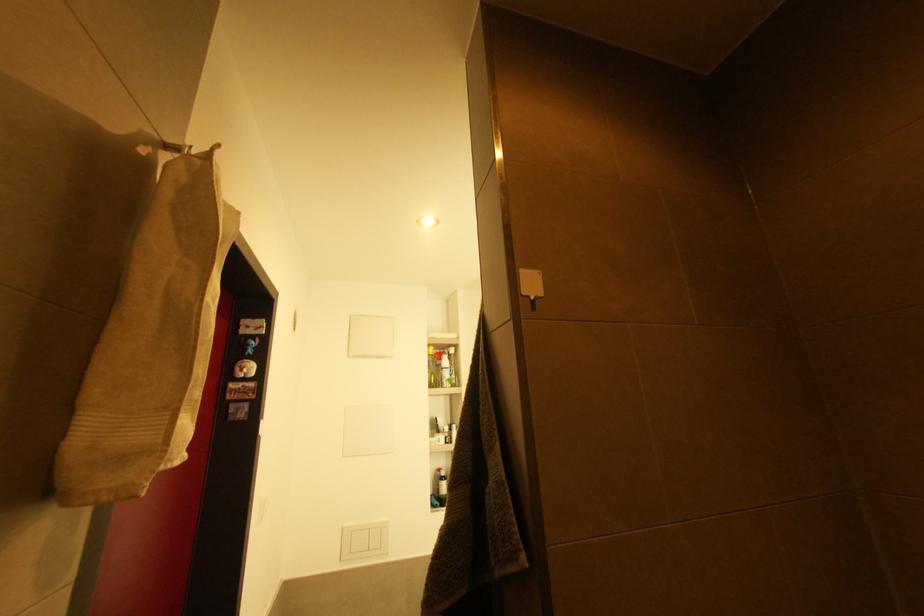
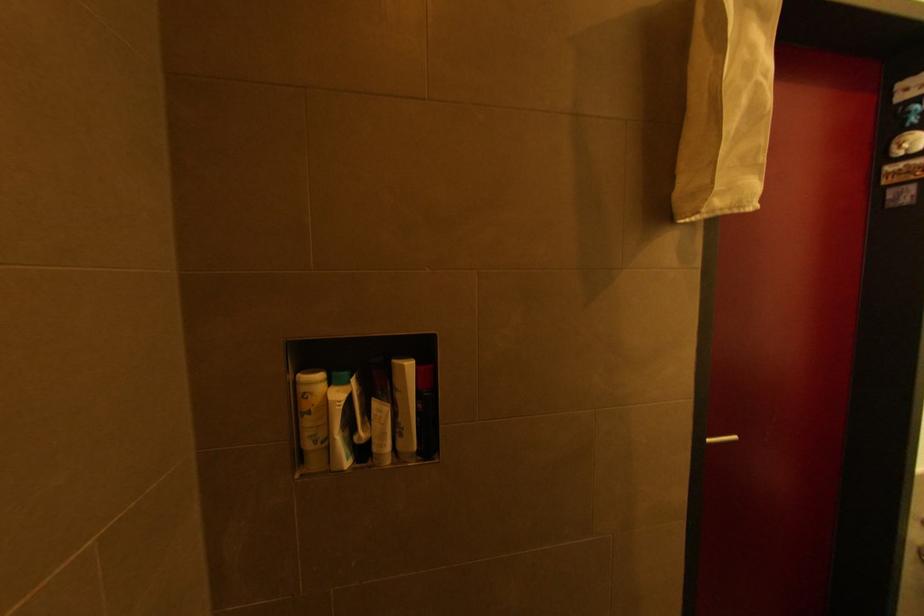
Question: The first image is from the beginning of the video and the second image is from the end. How did the camera likely rotate when shooting the video?

Choices:
 (A) Left
 (B) Right
 (C) Up
 (D) Down

Answer: (A)